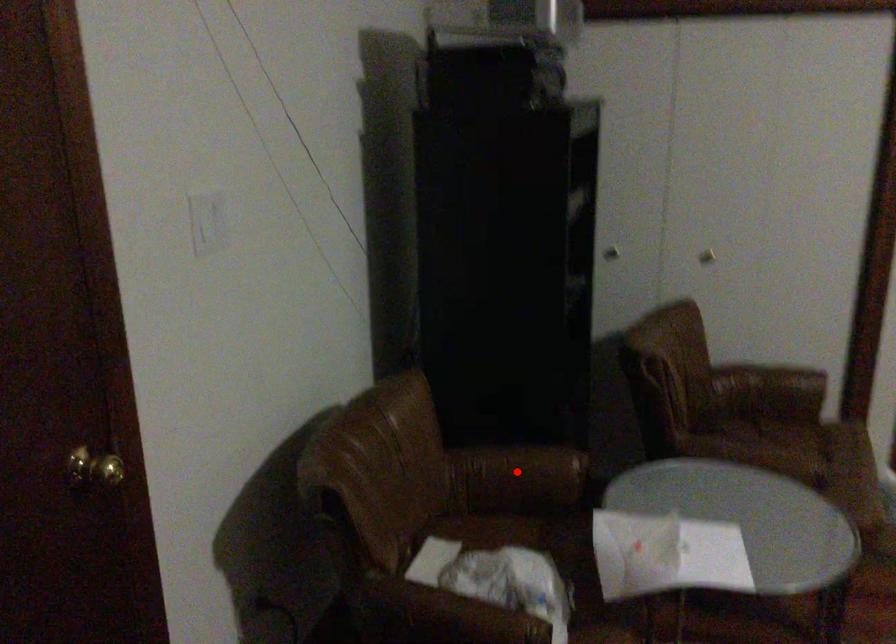
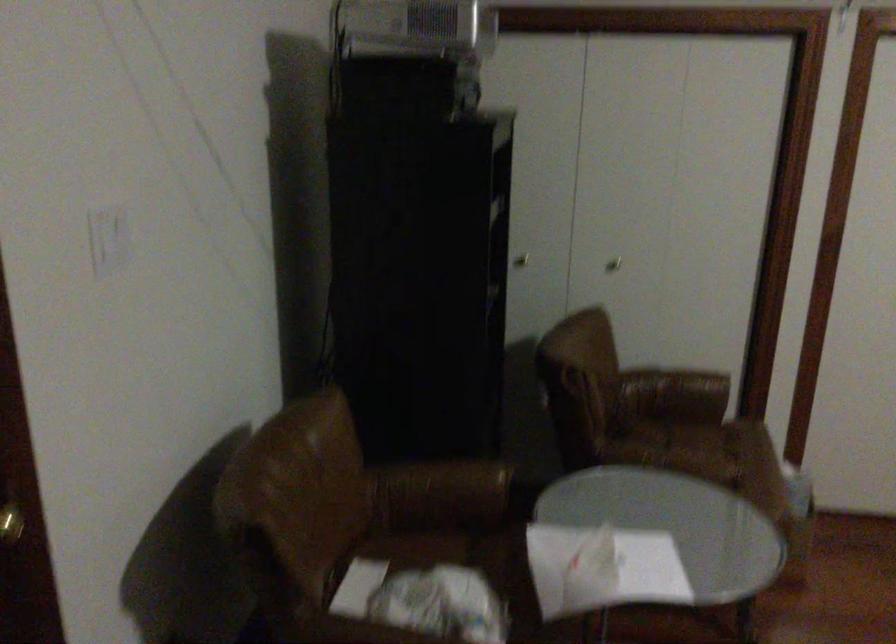
Find the pixel in the second image that matches the highlighted location in the first image.

(442, 488)